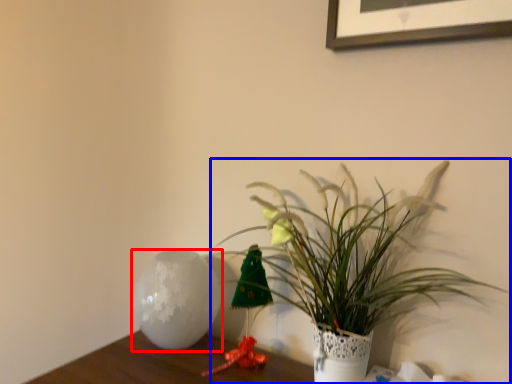
Question: Which point is further to the camera, vase (highlighted by a red box) or houseplant (highlighted by a blue box)?

Choices:
 (A) vase
 (B) houseplant

Answer: (A)